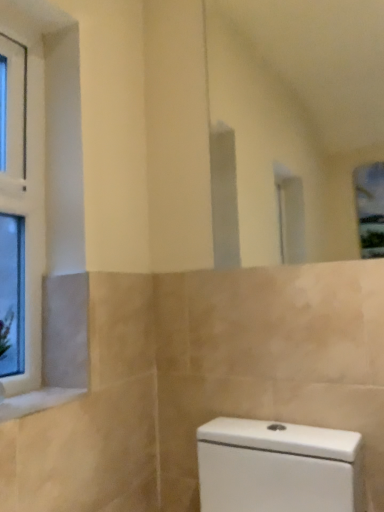
Question: Is white glass window at left to the left or to the right of white marble window sill at lower left in the image?

Choices:
 (A) left
 (B) right

Answer: (A)

Question: From the image's perspective, is white glass window at left positioned above or below white marble window sill at lower left?

Choices:
 (A) below
 (B) above

Answer: (B)

Question: Is white glass window at left inside the boundaries of white marble window sill at lower left, or outside?

Choices:
 (A) outside
 (B) inside

Answer: (A)

Question: Based on their sizes in the image, would you say white marble window sill at lower left is bigger or smaller than white glass window at left?

Choices:
 (A) small
 (B) big

Answer: (A)

Question: Is white marble window sill at lower left situated inside white glass window at left or outside?

Choices:
 (A) outside
 (B) inside

Answer: (A)

Question: Is white marble window sill at lower left in front of or behind white glass window at left in the image?

Choices:
 (A) behind
 (B) front

Answer: (B)

Question: From a real-world perspective, is white marble window sill at lower left physically located above or below white glass window at left?

Choices:
 (A) above
 (B) below

Answer: (B)